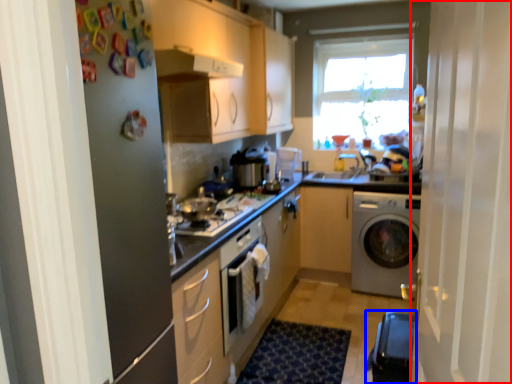
Question: Which of the following is the farthest to the observer, screen door (highlighted by a red box) or water heater (highlighted by a blue box)?

Choices:
 (A) screen door
 (B) water heater

Answer: (B)